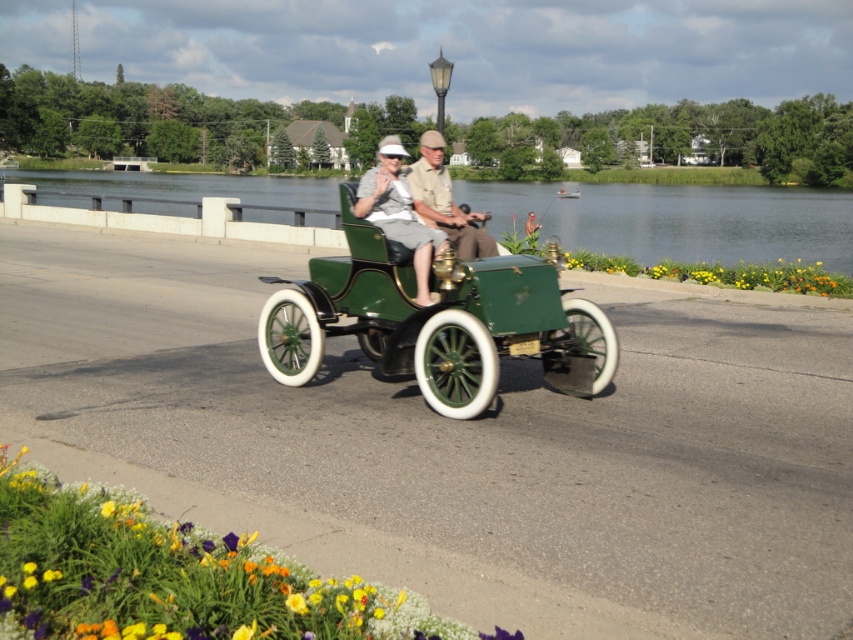
Question: Is yellow matte flower at right positioned in front of green matte vintage car at center?

Choices:
 (A) yes
 (B) no

Answer: (B)

Question: Is vibrant yellow petals at lower left closer to camera compared to yellow matte flower at right?

Choices:
 (A) yes
 (B) no

Answer: (A)

Question: Is vibrant yellow petals at lower left positioned in front of matte green car at center?

Choices:
 (A) yes
 (B) no

Answer: (A)

Question: Which object is farther from the camera taking this photo?

Choices:
 (A) green matte vintage car at center
 (B) green matte sidecar at center
 (C) vibrant yellow petals at lower left
 (D) yellow matte flower at right

Answer: (D)

Question: Which point appears closest to the camera in this image?

Choices:
 (A) (426, 170)
 (B) (202, 545)

Answer: (B)

Question: Which of the following is the closest to the observer?

Choices:
 (A) (793, 205)
 (B) (392, 193)
 (C) (827, 272)

Answer: (B)